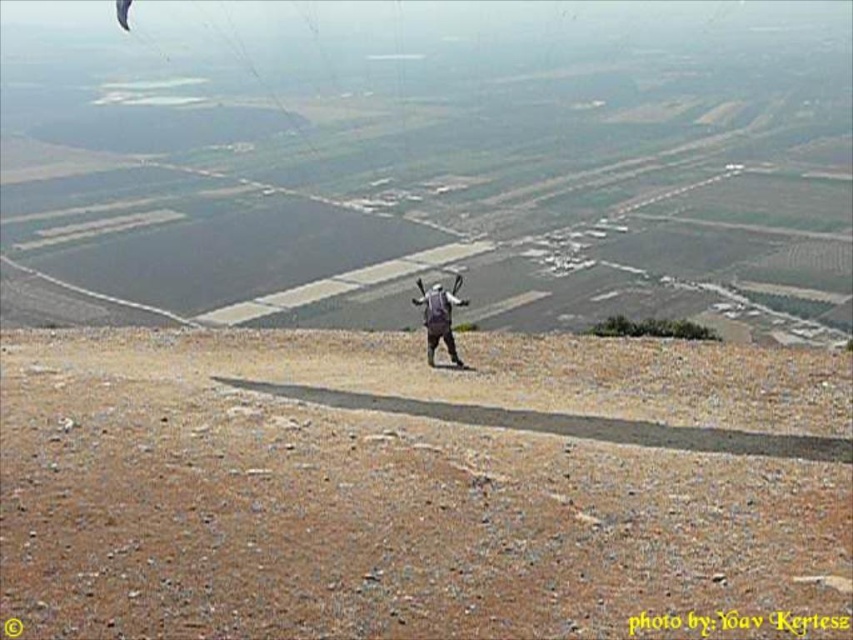
Which is above, brown gravel at center or matte gray backpack at center?

matte gray backpack at center is higher up.

Between brown gravel at center and matte gray backpack at center, which one appears on the right side from the viewer's perspective?

From the viewer's perspective, brown gravel at center appears more on the right side.

I want to click on brown gravel at center, so [x=409, y=484].

This screenshot has height=640, width=853. Identify the location of brown gravel at center. (409, 484).